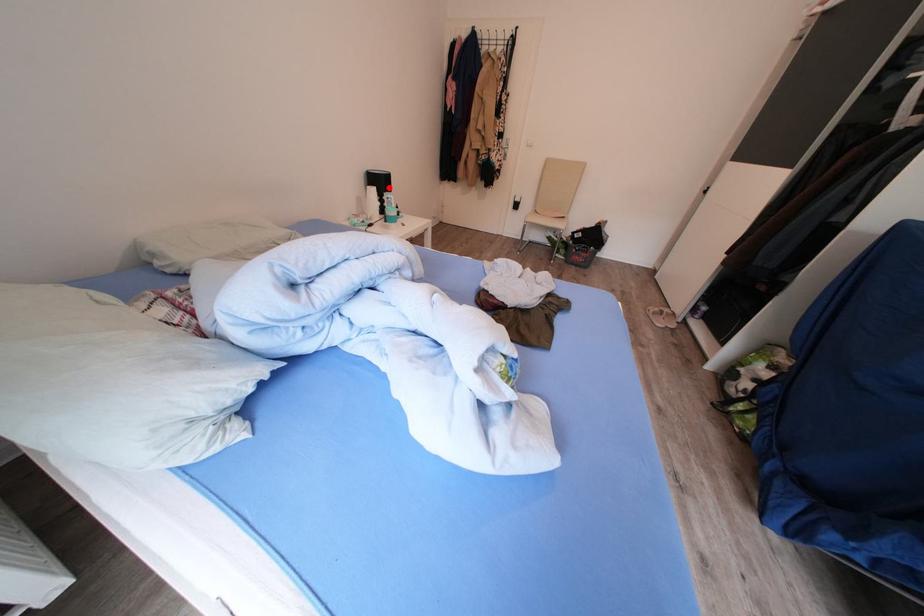
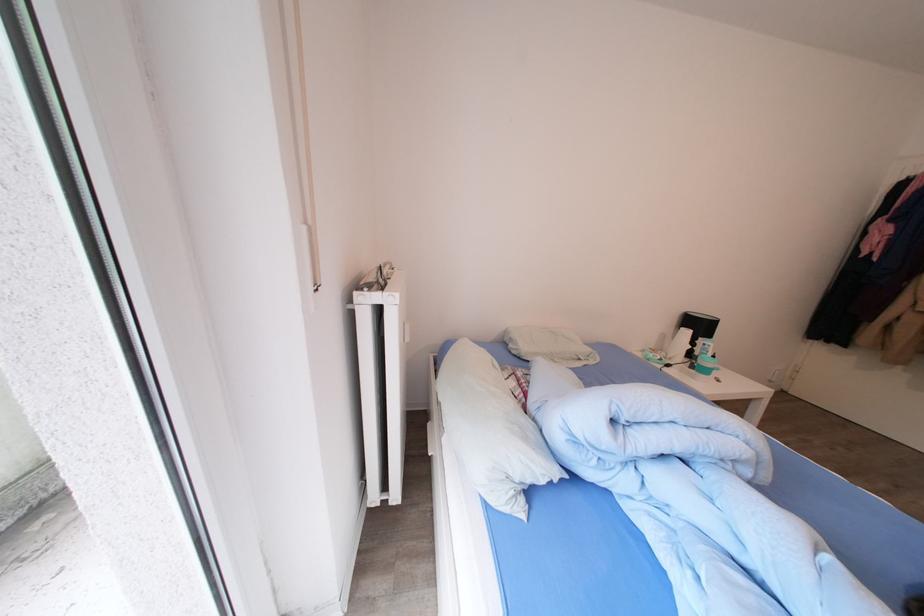
Find the pixel in the second image that matches the highlighted location in the first image.

(708, 331)